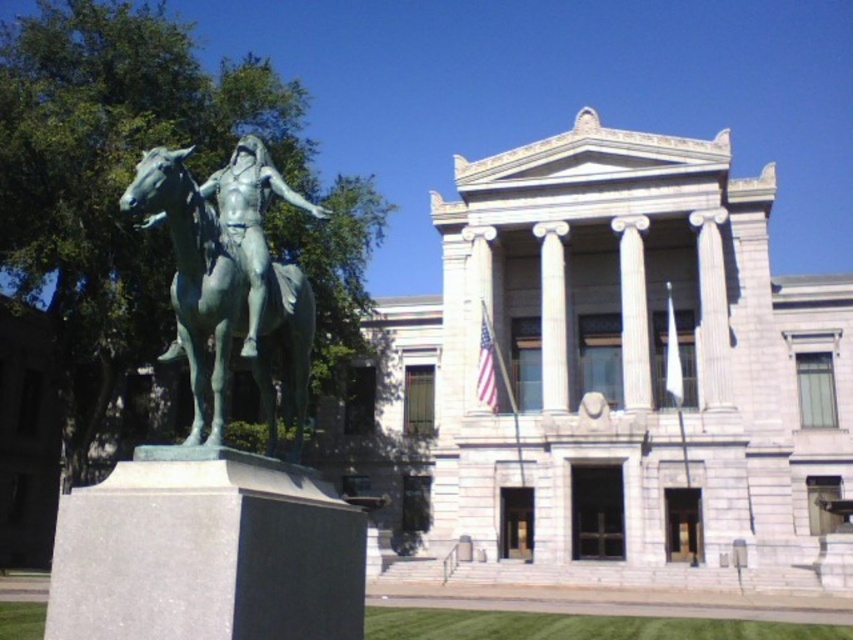
Question: Considering the real-world distances, which object is closest to the green patina bronze statue at left?

Choices:
 (A) white marble column at center
 (B) green grass at lower center

Answer: (B)

Question: Does green patina bronze statue at left have a lesser width compared to green grass at lower center?

Choices:
 (A) no
 (B) yes

Answer: (B)

Question: Considering the relative positions of green patina bronze statue at left and green grass at lower center in the image provided, where is green patina bronze statue at left located with respect to green grass at lower center?

Choices:
 (A) below
 (B) above

Answer: (B)

Question: Can you confirm if green grass at lower center is positioned above white marble column at center?

Choices:
 (A) no
 (B) yes

Answer: (A)

Question: Estimate the real-world distances between objects in this image. Which object is closer to the white marble column at center?

Choices:
 (A) green patina bronze statue at left
 (B) green grass at lower center

Answer: (B)

Question: Which of the following is the farthest from the observer?

Choices:
 (A) green patina bronze statue at left
 (B) green grass at lower center
 (C) white marble column at center

Answer: (C)